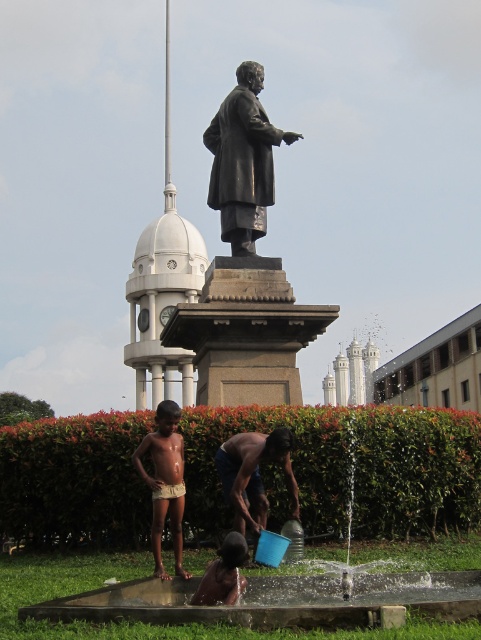
Question: Can you confirm if dark skin human at lower center is positioned to the right of white glossy flag pole at upper center?

Choices:
 (A) no
 (B) yes

Answer: (B)

Question: Which of the following is the closest to the observer?

Choices:
 (A) (168, 13)
 (B) (136, 460)

Answer: (B)

Question: Which is nearer to the white glossy flag pole at upper center?

Choices:
 (A) bronze statue at center
 (B) light brown skin at center
 (C) dark skin human at lower center
 (D) blue plastic bucket at lower center

Answer: (A)

Question: Is smooth concrete fountain at lower center below white glossy flag pole at upper center?

Choices:
 (A) yes
 (B) no

Answer: (A)

Question: Which of these objects is positioned farthest from the smooth concrete fountain at lower center?

Choices:
 (A) light brown skin at center
 (B) white glossy flag pole at upper center

Answer: (B)

Question: Is light brown skin at center smaller than dark skin human at lower center?

Choices:
 (A) yes
 (B) no

Answer: (B)